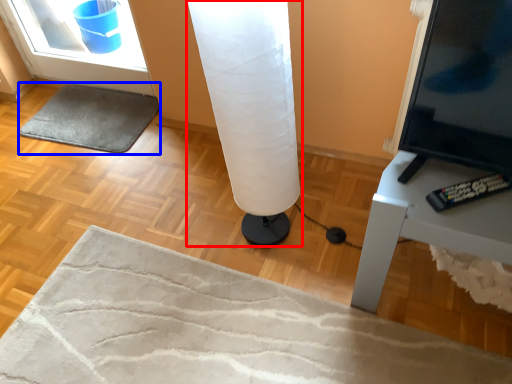
Question: Among these objects, which one is farthest to the camera, lamp (highlighted by a red box) or yoga mat (highlighted by a blue box)?

Choices:
 (A) lamp
 (B) yoga mat

Answer: (B)